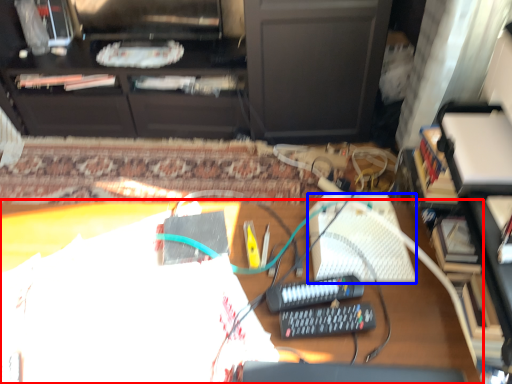
Question: Which object is closer to the camera taking this photo, desk (highlighted by a red box) or keyboard (highlighted by a blue box)?

Choices:
 (A) desk
 (B) keyboard

Answer: (A)